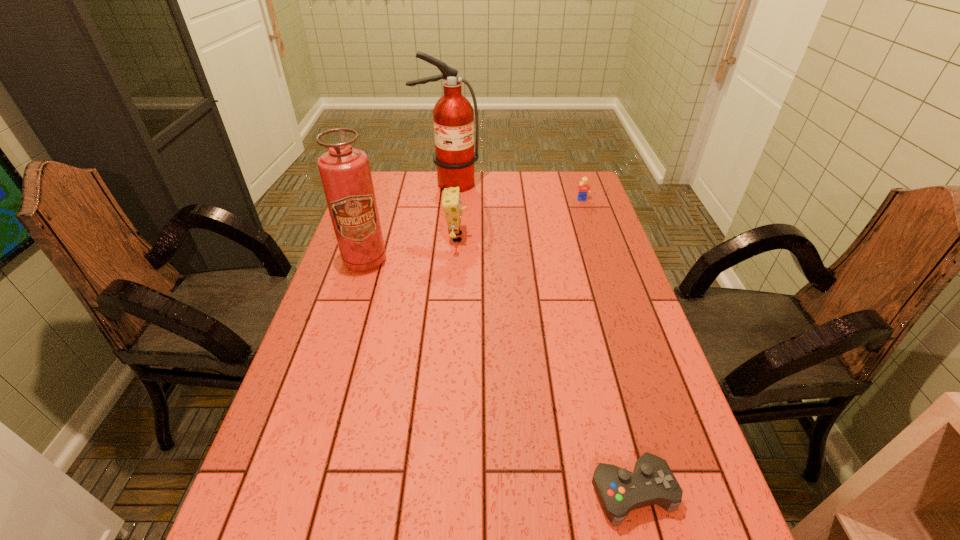
This screenshot has height=540, width=960. Find the location of `vacant space located on the label side of the left fire extinguisher`. vacant space located on the label side of the left fire extinguisher is located at coordinates (349, 308).

Locate an element on the screen. This screenshot has width=960, height=540. vacant point located on the face of the third shortest object is located at coordinates (525, 238).

At what (x,y) coordinates should I click in order to perform the action: click on vacant space located 0.270m on the face of the second shortest object. Please return your answer as a coordinate pair (x, y). The width and height of the screenshot is (960, 540). Looking at the image, I should click on (598, 248).

At what (x,y) coordinates should I click in order to perform the action: click on free space located 0.270m on the back of the shortest object. Please return your answer as a coordinate pair (x, y). Looking at the image, I should click on (598, 355).

Find the location of a particular element. This screenshot has height=540, width=960. fire extinguisher positioned at the far edge is located at coordinates (453, 115).

Identify the location of Lego located in the far edge section of the desktop. (584, 188).

Locate an element on the screen. object located at the left edge is located at coordinates (345, 173).

At what (x,y) coordinates should I click in order to perform the action: click on Lego that is at the right edge. Please return your answer as a coordinate pair (x, y). Image resolution: width=960 pixels, height=540 pixels. Looking at the image, I should click on (584, 188).

You are a GUI agent. You are given a task and a screenshot of the screen. Output one action in this format:
    pyautogui.click(x=<x>, y=<y>)
    Task: Click on the control situated at the right edge
    This screenshot has height=540, width=960.
    Given the screenshot: What is the action you would take?
    pyautogui.click(x=619, y=491)

Locate an element on the screen. The image size is (960, 540). object that is at the far right corner is located at coordinates (584, 188).